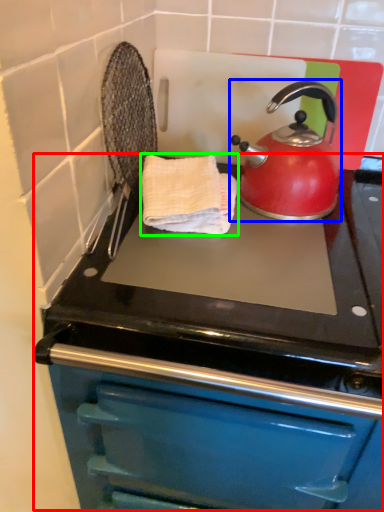
Question: Estimate the real-world distances between objects in this image. Which object is farther from oven (highlighted by a red box), kettle (highlighted by a blue box) or hand towel (highlighted by a green box)?

Choices:
 (A) kettle
 (B) hand towel

Answer: (A)